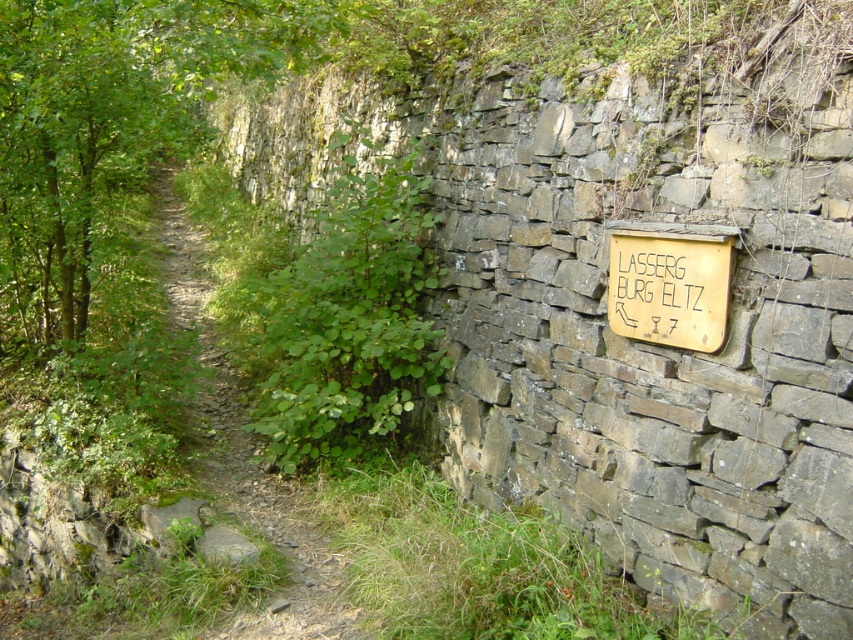
You are standing on the dirt path at left and want to go to the wooden sign at right. Which direction should you go?

You should go to the right because the dirt path at left is to the left of wooden sign at right, so moving right will take you towards the wooden sign at right.

You are standing on the dirt path at left and want to walk towards the green leafy tree at center. Can you see the tree clearly from your current position?

The dirt path at left is behind green leafy tree at center, so you cannot see the tree clearly from your current position on the dirt path at left.

Based on the photo, what is the coordinate of the dirt path at left?

The dirt path at left is located at coordinate point [248,456].